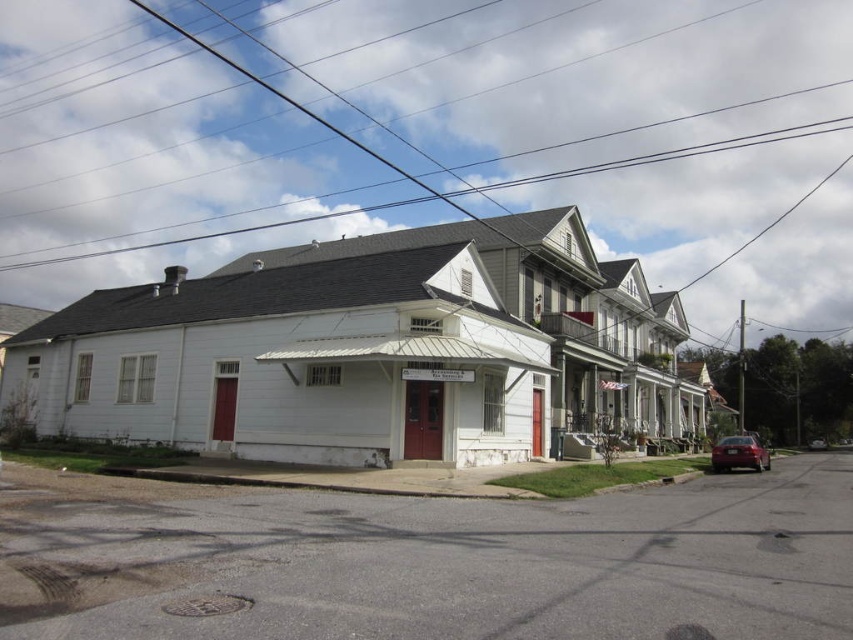
Does shiny red sedan at lower right appear over metallic silver car at right?

Yes, shiny red sedan at lower right is above metallic silver car at right.

Is point (761, 468) farther from camera compared to point (824, 445)?

No, (761, 468) is in front of (824, 445).

What do you see at coordinates (740, 454) in the screenshot? I see `shiny red sedan at lower right` at bounding box center [740, 454].

Identify the location of shiny red sedan at lower right. The height and width of the screenshot is (640, 853). (740, 454).